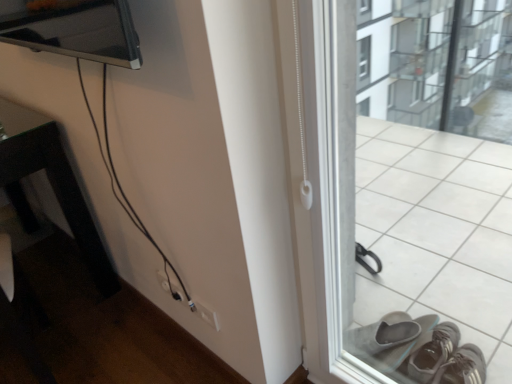
Question: Is white plastic window frame at right bigger or smaller than black glossy table at left?

Choices:
 (A) big
 (B) small

Answer: (B)

Question: Considering the positions of white plastic window frame at right and black glossy table at left in the image, is white plastic window frame at right taller or shorter than black glossy table at left?

Choices:
 (A) short
 (B) tall

Answer: (B)

Question: Which object is positioned closest to the black glossy table at left?

Choices:
 (A) white plastic window frame at right
 (B) white plastic electric outlet at lower center

Answer: (B)

Question: Which object is positioned farthest from the white plastic window frame at right?

Choices:
 (A) black glossy table at left
 (B) white plastic electric outlet at lower center

Answer: (A)